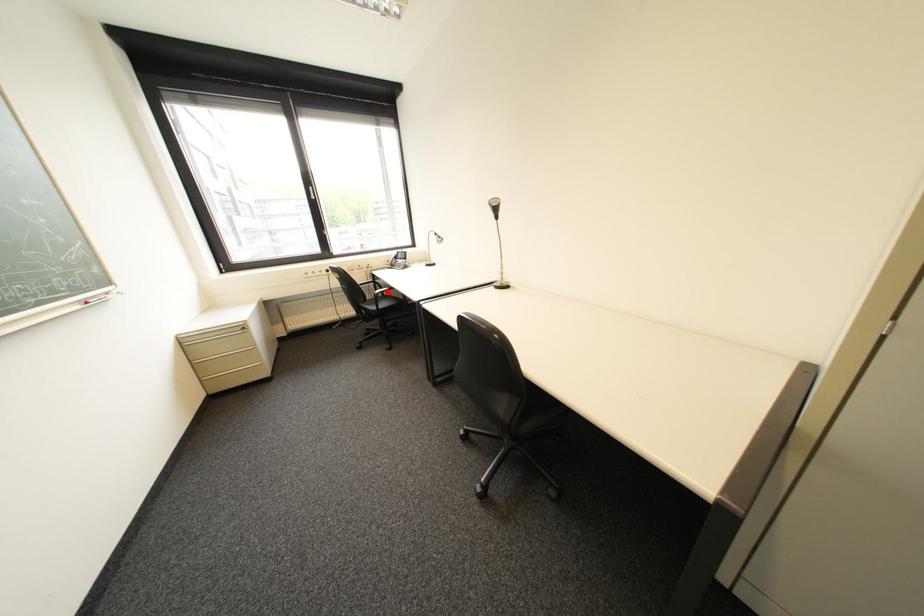
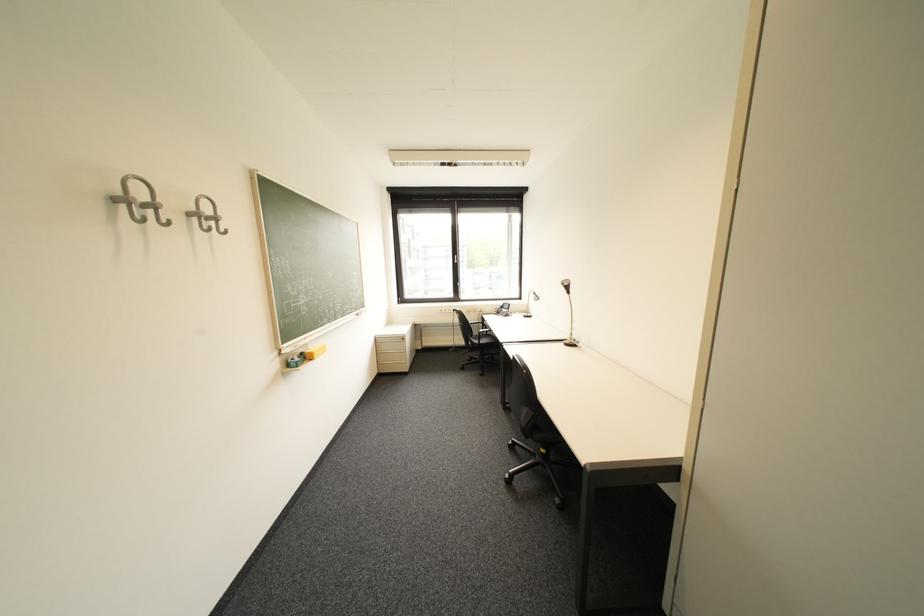
Question: I am providing you with two images of the same scene from different viewpoints. In image1, a red point is highlighted. Considering the same 3D point in image2, which of the following is correct?

Choices:
 (A) It is closer
 (B) It is farther

Answer: (B)